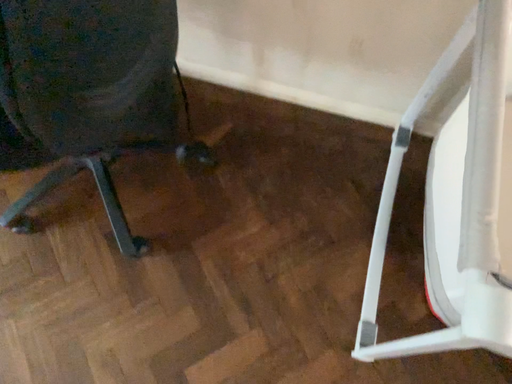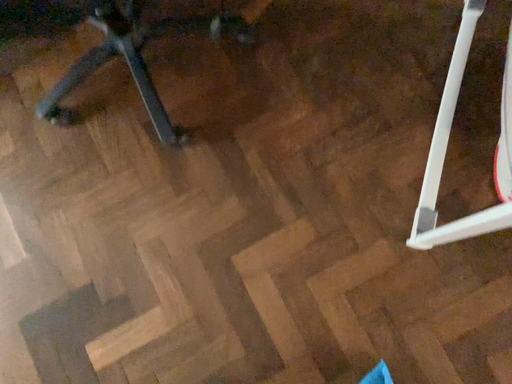
Question: How did the camera likely rotate when shooting the video?

Choices:
 (A) rotated upward
 (B) rotated downward

Answer: (B)